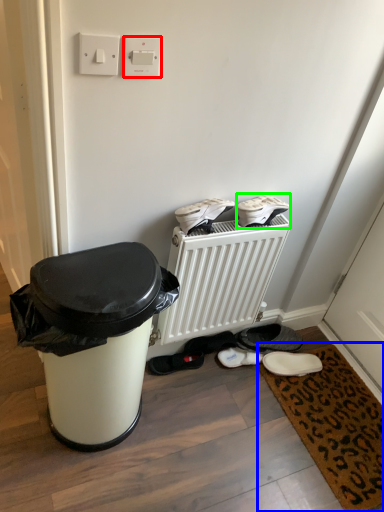
Question: Which object is the closest to the electric outlet (highlighted by a red box)? Choose among these: doormat (highlighted by a blue box) or footwear (highlighted by a green box).

Choices:
 (A) doormat
 (B) footwear

Answer: (B)